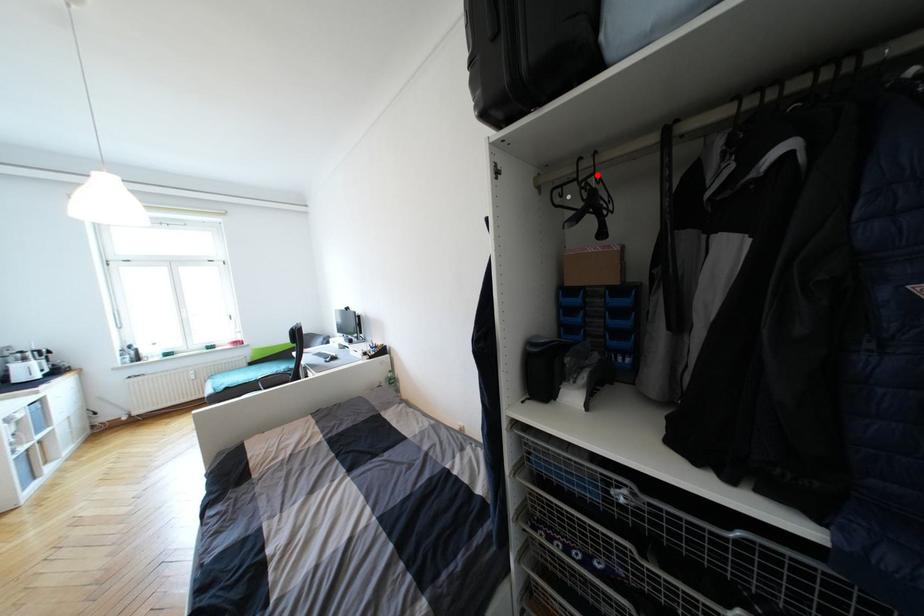
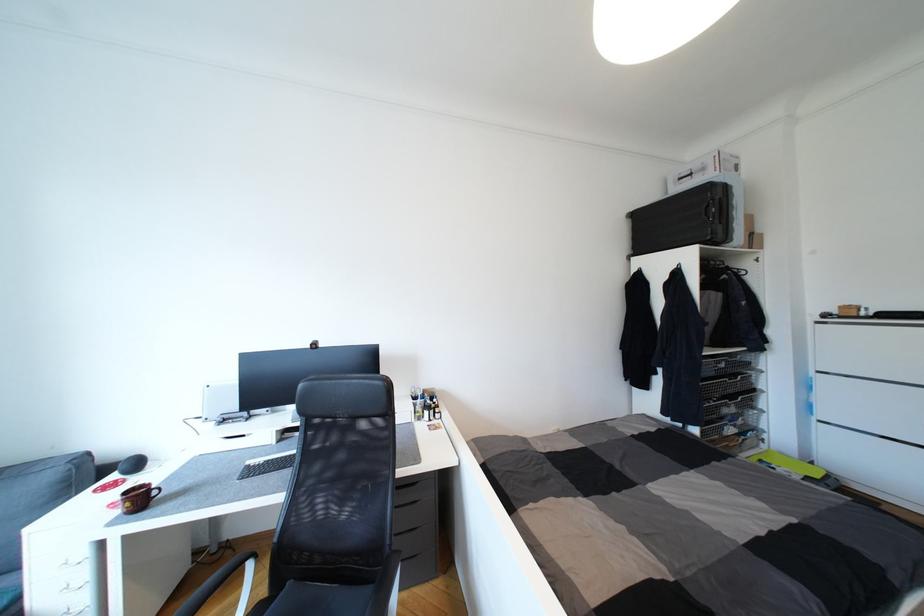
Question: I am providing you with two images of the same scene from different viewpoints. A red point is marked on the first image. Is the red point's position out of view in image 2?

Choices:
 (A) Yes
 (B) No

Answer: (A)